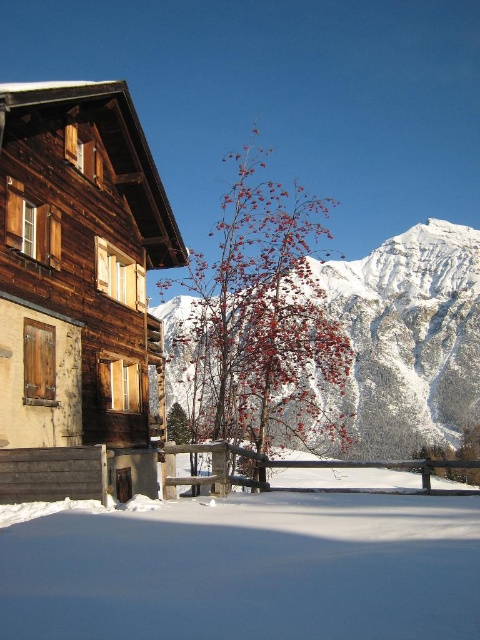
Question: Which point is closer to the camera taking this photo?

Choices:
 (A) (10, 474)
 (B) (402, 243)

Answer: (A)

Question: Where is white powdery snow at lower center located in relation to snowy white mountain at center in the image?

Choices:
 (A) above
 (B) below

Answer: (B)

Question: Which of these objects is positioned farthest from the white powdery snow at lower center?

Choices:
 (A) snowy white mountain at center
 (B) wooden chalet at left

Answer: (A)

Question: Which point is closer to the camera?

Choices:
 (A) snowy white mountain at center
 (B) wooden chalet at left

Answer: (B)

Question: Does white powdery snow at lower center appear on the left side of snowy white mountain at center?

Choices:
 (A) yes
 (B) no

Answer: (A)

Question: Is white powdery snow at lower center below snowy white mountain at center?

Choices:
 (A) yes
 (B) no

Answer: (A)